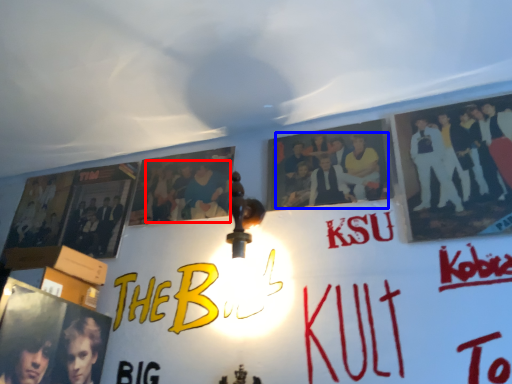
Question: Which of the following is the closest to the observer, person (highlighted by a red box) or person (highlighted by a blue box)?

Choices:
 (A) person
 (B) person

Answer: (B)